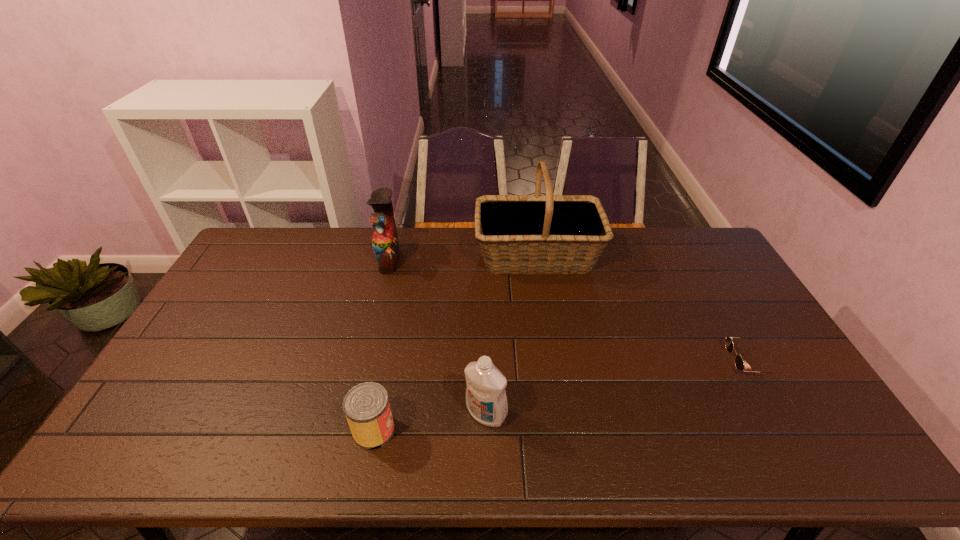
Where is `vacant space at the left edge of the desktop`? Image resolution: width=960 pixels, height=540 pixels. vacant space at the left edge of the desktop is located at coordinates (229, 310).

I want to click on vacant space at the far left corner of the desktop, so click(285, 234).

The width and height of the screenshot is (960, 540). I want to click on blank area at the far right corner, so click(699, 256).

I want to click on free space between the third nearest object and the parrot, so click(x=568, y=310).

This screenshot has height=540, width=960. I want to click on free space between the shortest object and the second shortest object, so click(561, 396).

What are the coordinates of `vacant space in between the rightmost object and the fourth tallest object` in the screenshot? It's located at (561, 396).

The width and height of the screenshot is (960, 540). What are the coordinates of `free spot between the third nearest object and the tallest object` in the screenshot? It's located at pos(642,309).

Where is `vacant space that is in between the sunglasses and the parrot`? vacant space that is in between the sunglasses and the parrot is located at coordinates (568, 310).

You are a GUI agent. You are given a task and a screenshot of the screen. Output one action in this format:
    pyautogui.click(x=<x>, y=<y>)
    Task: Click on the vacant point located between the parrot and the second shortest object
    This screenshot has width=960, height=540.
    Given the screenshot: What is the action you would take?
    pyautogui.click(x=381, y=345)

I want to click on empty space that is in between the parrot and the rightmost object, so click(568, 310).